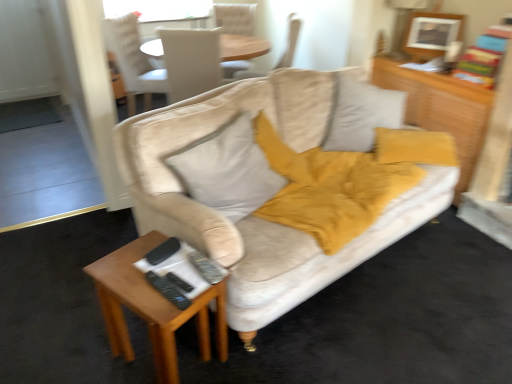
Question: From the image's perspective, is wooden dresser at upper right beneath soft white pillow at center?

Choices:
 (A) no
 (B) yes

Answer: (A)

Question: Considering the relative positions of wooden dresser at upper right and soft white pillow at center in the image provided, is wooden dresser at upper right to the right of soft white pillow at center from the viewer's perspective?

Choices:
 (A) no
 (B) yes

Answer: (B)

Question: Is wooden dresser at upper right further to the viewer compared to soft white pillow at center?

Choices:
 (A) no
 (B) yes

Answer: (B)

Question: Is wooden dresser at upper right looking in the opposite direction of soft white pillow at center?

Choices:
 (A) no
 (B) yes

Answer: (A)

Question: From a real-world perspective, is wooden dresser at upper right physically above soft white pillow at center?

Choices:
 (A) no
 (B) yes

Answer: (A)

Question: From the image's perspective, relative to velvet beige couch at center, is wooden dresser at upper right above or below?

Choices:
 (A) below
 (B) above

Answer: (B)

Question: Is point (463, 172) positioned closer to the camera than point (309, 135)?

Choices:
 (A) closer
 (B) farther

Answer: (B)

Question: Choose the correct answer: Is wooden dresser at upper right inside velvet beige couch at center or outside it?

Choices:
 (A) outside
 (B) inside

Answer: (A)

Question: In terms of width, does wooden dresser at upper right look wider or thinner when compared to velvet beige couch at center?

Choices:
 (A) wide
 (B) thin

Answer: (B)

Question: From a real-world perspective, is soft white pillow at center physically located above or below beige fabric chair at upper center, arranged as the second chair when viewed from the left?

Choices:
 (A) below
 (B) above

Answer: (A)

Question: Does point (233, 213) appear closer or farther from the camera than point (204, 39)?

Choices:
 (A) farther
 (B) closer

Answer: (B)

Question: Is soft white pillow at center spatially inside beige fabric chair at upper center, arranged as the second chair when viewed from the left, or outside of it?

Choices:
 (A) outside
 (B) inside

Answer: (A)

Question: In terms of height, does soft white pillow at center look taller or shorter compared to beige fabric chair at upper center, the third chair from the right?

Choices:
 (A) short
 (B) tall

Answer: (A)

Question: Based on their sizes in the image, would you say beige fabric chair at upper center, which ranks as the first chair in right-to-left order, is bigger or smaller than wooden rectangular table at lower left?

Choices:
 (A) big
 (B) small

Answer: (A)

Question: Do you think beige fabric chair at upper center, which ranks as the first chair in right-to-left order, is within wooden rectangular table at lower left, or outside of it?

Choices:
 (A) inside
 (B) outside

Answer: (B)